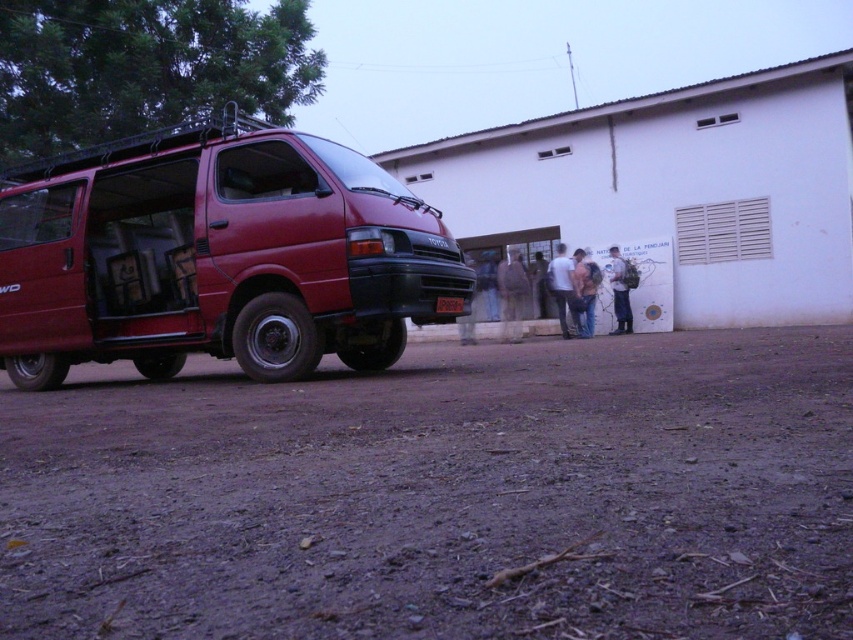
Question: Which object is farther from the camera taking this photo?

Choices:
 (A) dusty brown dirt at lower center
 (B) matte red van at left

Answer: (B)

Question: Is dusty brown dirt at lower center positioned before matte red van at left?

Choices:
 (A) no
 (B) yes

Answer: (B)

Question: Considering the relative positions of dusty brown dirt at lower center and matte red van at left in the image provided, where is dusty brown dirt at lower center located with respect to matte red van at left?

Choices:
 (A) left
 (B) right

Answer: (B)

Question: Which of the following is the closest to the observer?

Choices:
 (A) dusty brown dirt at lower center
 (B) matte red van at left

Answer: (A)

Question: Observing the image, what is the correct spatial positioning of dusty brown dirt at lower center in reference to matte red van at left?

Choices:
 (A) right
 (B) left

Answer: (A)